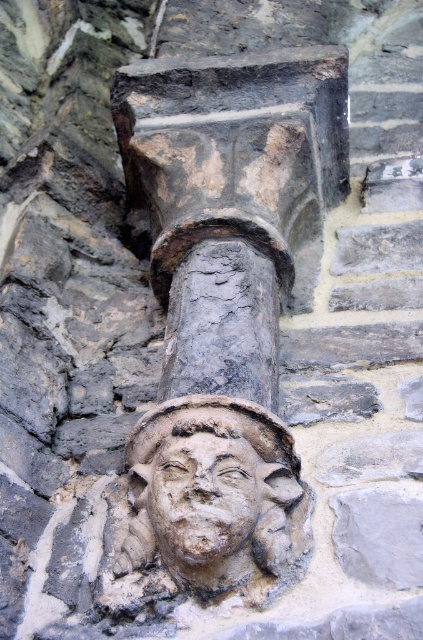
Looking at this image, does dark gray stone pillar at center appear on the left side of stone carved face at center?

No, dark gray stone pillar at center is not to the left of stone carved face at center.

Where is `dark gray stone pillar at center`? This screenshot has height=640, width=423. dark gray stone pillar at center is located at coordinates (233, 202).

What do you see at coordinates (233, 202) in the screenshot? I see `dark gray stone pillar at center` at bounding box center [233, 202].

The width and height of the screenshot is (423, 640). I want to click on dark gray stone pillar at center, so click(x=233, y=202).